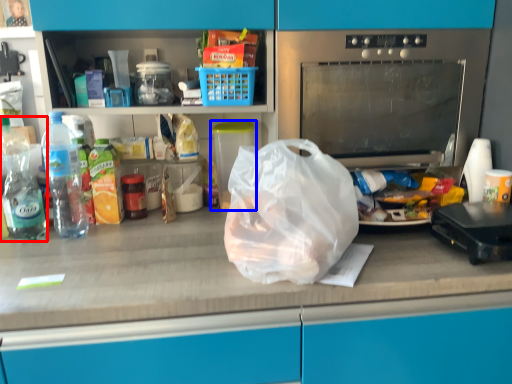
Question: Which object appears farthest to the camera in this image, bottle (highlighted by a red box) or appliance (highlighted by a blue box)?

Choices:
 (A) bottle
 (B) appliance

Answer: (B)